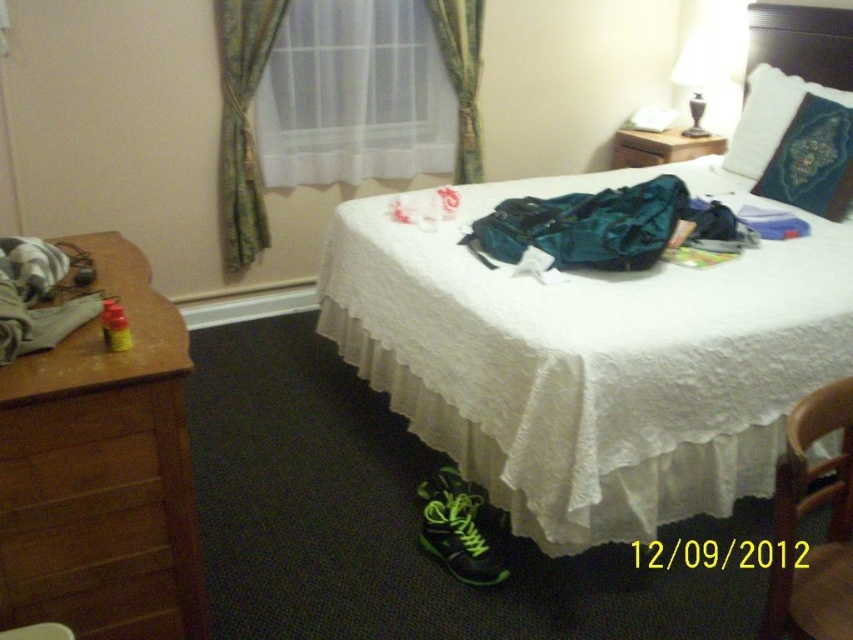
Between point (273, 10) and point (610, 161), which one is positioned behind?

Point (610, 161)

Is point (225, 257) positioned before point (723, 138)?

That is True.

I want to click on green floral fabric curtain at upper left, so click(242, 124).

Who is shorter, white sheer curtain at upper center or brown wood nightstand at upper right?

With less height is brown wood nightstand at upper right.

Can you confirm if white sheer curtain at upper center is positioned to the right of brown wood nightstand at upper right?

In fact, white sheer curtain at upper center is to the left of brown wood nightstand at upper right.

Is point (224, 64) positioned after point (721, 144)?

No, it is in front of (721, 144).

This screenshot has width=853, height=640. In order to click on white sheer curtain at upper center in this screenshot , I will do `click(242, 124)`.

Based on the photo, does brown wood dresser at left appear on the right side of green velvet pillow at upper right?

Incorrect, brown wood dresser at left is not on the right side of green velvet pillow at upper right.

The height and width of the screenshot is (640, 853). What are the coordinates of `brown wood dresser at left` in the screenshot? It's located at (102, 472).

Does point (28, 592) come farther from viewer compared to point (787, 125)?

No, (28, 592) is in front of (787, 125).

Identify the location of brown wood dresser at left. [x=102, y=472].